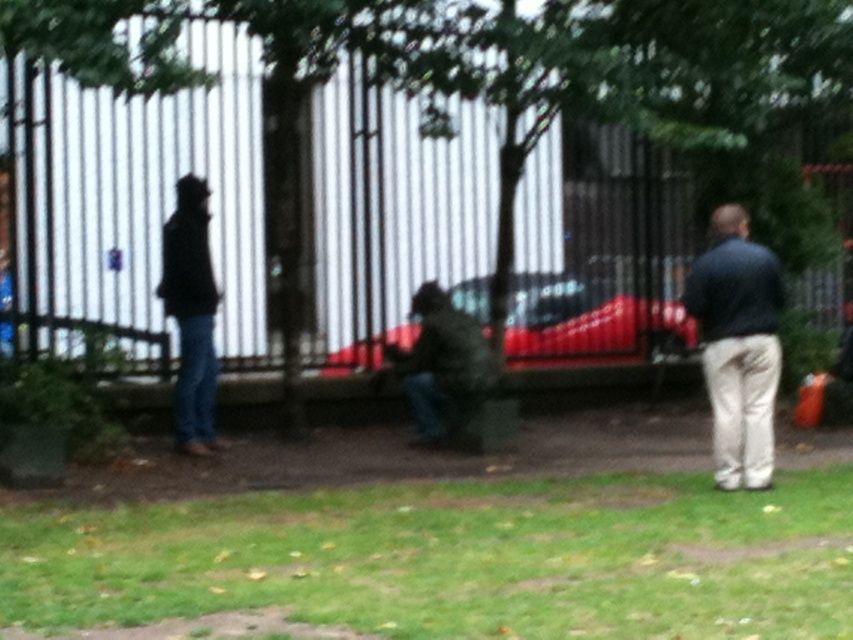
Question: Is black matte jacket at left thinner than camouflage fabric jacket at center?

Choices:
 (A) no
 (B) yes

Answer: (B)

Question: Based on their relative distances, which object is nearer to the black matte jacket at left?

Choices:
 (A) camouflage fabric jacket at center
 (B) shiny red car at center

Answer: (A)

Question: Is black matte jacket at left positioned behind camouflage fabric jacket at center?

Choices:
 (A) yes
 (B) no

Answer: (B)

Question: Which object is farther from the camera taking this photo?

Choices:
 (A) dark blue jeans at right
 (B) black matte jacket at left
 (C) camouflage fabric jacket at center

Answer: (C)

Question: Among these objects, which one is nearest to the camera?

Choices:
 (A) black matte jacket at left
 (B) dark blue jeans at right
 (C) camouflage fabric jacket at center
 (D) shiny red car at center

Answer: (B)

Question: In this image, where is dark blue jeans at right located relative to black matte jacket at left?

Choices:
 (A) left
 (B) right

Answer: (B)